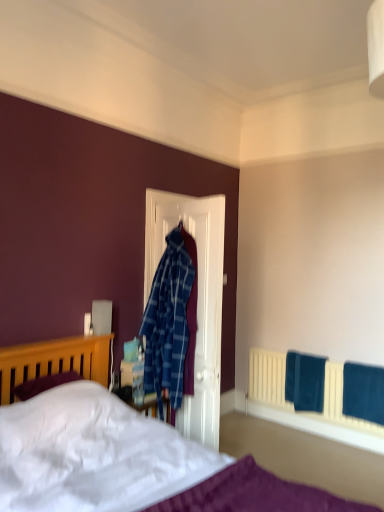
Question: Looking at their shapes, would you say teal fabric towel at lower right, marked as the first bath towel in a left-to-right arrangement, is wider or thinner than white soft bed at lower left?

Choices:
 (A) thin
 (B) wide

Answer: (A)

Question: From a real-world perspective, is teal fabric towel at lower right, the second bath towel in the right-to-left sequence, above or below white soft bed at lower left?

Choices:
 (A) above
 (B) below

Answer: (B)

Question: Considering the real-world distances, which object is farthest from the white soft bed at lower left?

Choices:
 (A) teal fabric towel at lower right, marked as the first bath towel in a left-to-right arrangement
 (B) velvet blue bath towel at lower right, which is the 1th bath towel in front-to-back order

Answer: (B)

Question: Considering the real-world distances, which object is closest to the velvet blue bath towel at lower right, which is the 1th bath towel in front-to-back order?

Choices:
 (A) teal fabric towel at lower right, the second bath towel in the right-to-left sequence
 (B) white soft bed at lower left

Answer: (B)